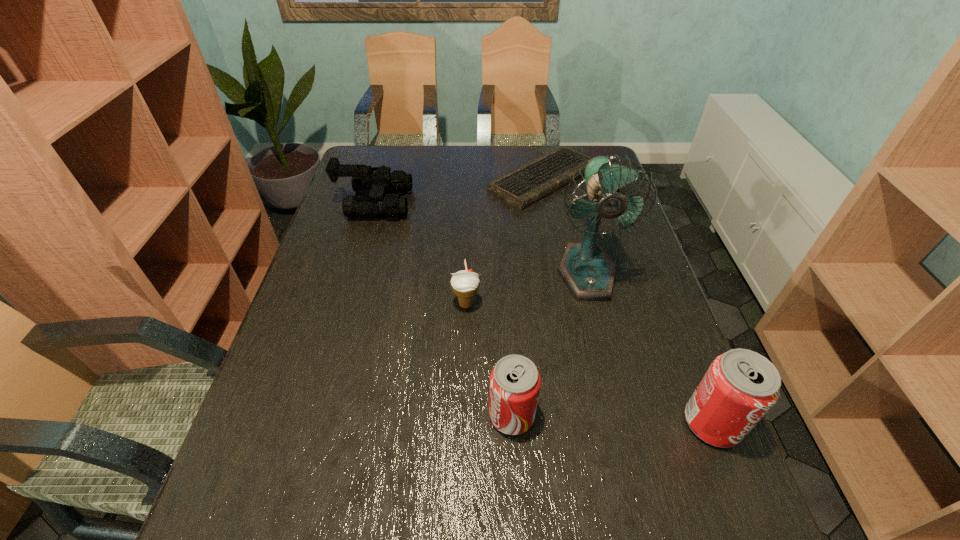
Identify the location of vacant area that lies between the right soda can and the tallest object. Image resolution: width=960 pixels, height=540 pixels. [x=650, y=348].

In order to click on vacant area between the fifth object from right to left and the leftmost object in this screenshot , I will do tap(420, 254).

At what (x,y) coordinates should I click in order to perform the action: click on free spot between the fan and the computer keyboard. Please return your answer as a coordinate pair (x, y). The image size is (960, 540). Looking at the image, I should click on (564, 226).

Where is `unoccupied area between the fan and the left soda can`? This screenshot has width=960, height=540. unoccupied area between the fan and the left soda can is located at coordinates (549, 344).

This screenshot has height=540, width=960. I want to click on blank region between the fan and the shortest object, so click(564, 226).

Select which object is the fifth closest to the binoculars. Please provide its 2D coordinates. Your answer should be formatted as a tuple, i.e. [(x, y)], where the tuple contains the x and y coordinates of a point satisfying the conditions above.

[(740, 386)]

Image resolution: width=960 pixels, height=540 pixels. In order to click on object that is the third nearest to the computer keyboard in this screenshot , I will do tap(465, 284).

The width and height of the screenshot is (960, 540). Identify the location of vacant area in the image that satisfies the following two spatial constraints: 1. on the front lenses of the leftmost object; 2. on the back side of the left soda can. (313, 415).

In order to click on free space that satisfies the following two spatial constraints: 1. in front of the taller soda can where the wind blows; 2. on the left side of the tallest object in this screenshot , I will do `click(624, 423)`.

You are a GUI agent. You are given a task and a screenshot of the screen. Output one action in this format:
    pyautogui.click(x=<x>, y=<y>)
    Task: Click on the vacant position in the image that satisfies the following two spatial constraints: 1. on the back side of the left soda can; 2. on the front lenses of the leftmost object
    
    Given the screenshot: What is the action you would take?
    pyautogui.click(x=500, y=204)